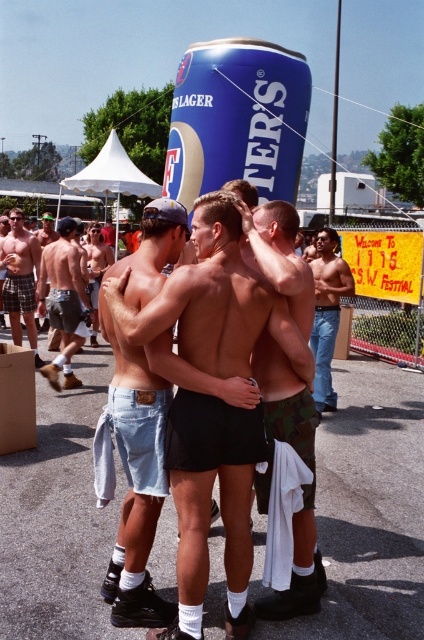
You are at the 1995 S.W. Festival and see a blue matte beer can at center and a light brown denim shorts at center. Which object is located to the right of the other?

The blue matte beer can at center is positioned on the right side of light brown denim shorts at center.

You are a photographer at the festival and want to take a photo of the blue matte beer can at center and the light brown denim shorts at center. Which object is closer to the camera?

The blue matte beer can at center is closer to the camera since the light brown denim shorts at center is behind it.

You are a photographer at the festival and want to capture both the black matte shorts at center and the light brown denim shorts at center in your photo. However, your camera can only focus on one subject at a time. Which pair of shorts should you focus on to ensure the other is still visible in the background?

You should focus on the black matte shorts at center because it is in front of the light brown denim shorts at center, so the latter will naturally appear in the background.